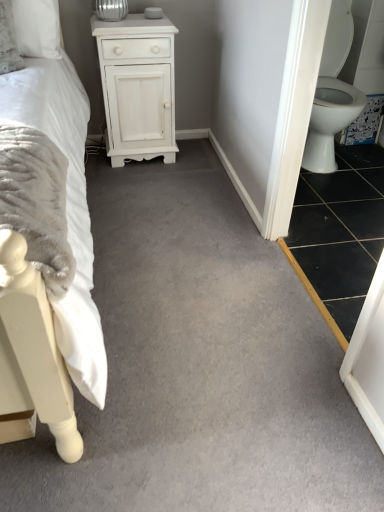
Locate an element on the screen. The width and height of the screenshot is (384, 512). free space in front of white matte cabinet at upper center is located at coordinates (139, 183).